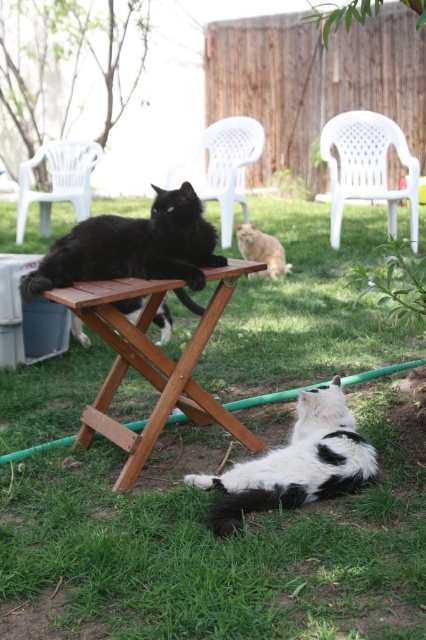
Question: Which of the following is the closest to the observer?

Choices:
 (A) black and white fur cat at lower center
 (B) white plastic chair at upper left
 (C) green grass at center
 (D) white plastic chair at center

Answer: (A)

Question: Which object appears farthest from the camera in this image?

Choices:
 (A) green grass at center
 (B) white plastic chair at upper left

Answer: (B)

Question: Based on their relative distances, which object is farther from the black glossy cat at center?

Choices:
 (A) white plastic chair at center
 (B) white plastic chair at upper right
 (C) white plastic chair at upper left
 (D) fluffy orange cat at center

Answer: (A)

Question: Can you confirm if black and white fur cat at lower center is positioned above white plastic chair at center?

Choices:
 (A) yes
 (B) no

Answer: (B)

Question: Considering the relative positions of white plastic chair at upper right and white plastic chair at upper left in the image provided, where is white plastic chair at upper right located with respect to white plastic chair at upper left?

Choices:
 (A) left
 (B) right

Answer: (B)

Question: Is wooden table at center bigger than fluffy orange cat at center?

Choices:
 (A) yes
 (B) no

Answer: (A)